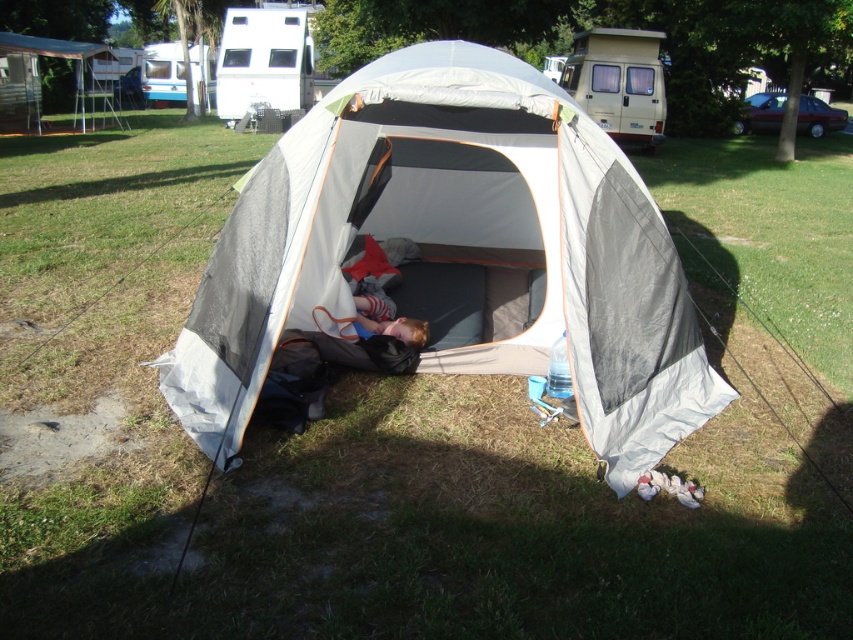
Question: Is white plastic camper at upper left to the right of metallic silver van at upper right from the viewer's perspective?

Choices:
 (A) yes
 (B) no

Answer: (B)

Question: Which object is the farthest from the beige plastic recreational vehicle at upper center?

Choices:
 (A) matte blue shirt at lower center
 (B) metallic silver van at upper right

Answer: (A)

Question: Observing the image, what is the correct spatial positioning of white fabric tent at center in reference to blue metallic trailer at upper left?

Choices:
 (A) above
 (B) below

Answer: (B)

Question: Can you confirm if white fabric tent at center is smaller than beige plastic recreational vehicle at upper center?

Choices:
 (A) no
 (B) yes

Answer: (B)

Question: Which object appears closest to the camera in this image?

Choices:
 (A) blue metallic trailer at upper left
 (B) matte blue shirt at lower center

Answer: (B)

Question: Which object is farther from the camera taking this photo?

Choices:
 (A) blue metallic trailer at upper left
 (B) metallic silver van at upper right

Answer: (A)